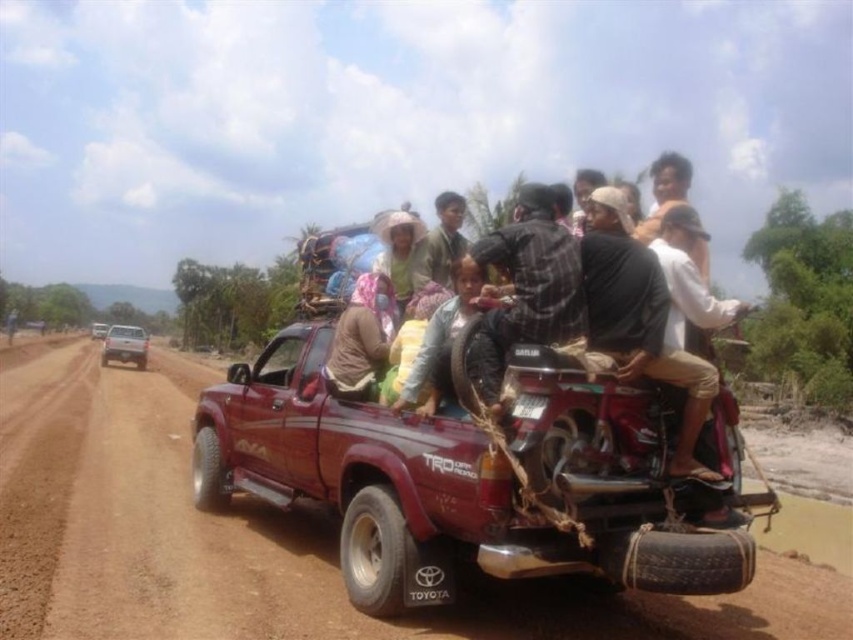
Question: Is light blue fabric at center smaller than metallic silver pickup truck at center-left?

Choices:
 (A) no
 (B) yes

Answer: (B)

Question: Which point is farther from the camera taking this photo?

Choices:
 (A) (334, 352)
 (B) (93, 326)
 (C) (426, 266)
 (D) (35, 426)

Answer: (B)

Question: Is metallic silver pickup truck at center wider than metallic silver pickup truck at center-left?

Choices:
 (A) no
 (B) yes

Answer: (B)

Question: Which point is farther to the camera?

Choices:
 (A) light blue fabric at center
 (B) metallic silver pickup truck at center
 (C) metallic silver pickup truck at center-left
 (D) brown dirt track at center

Answer: (C)

Question: Among these points, which one is nearest to the camera?

Choices:
 (A) (450, 250)
 (B) (351, 326)
 (C) (96, 330)
 (D) (106, 340)

Answer: (B)

Question: Does brown fabric bag at center lie in front of metallic silver pickup truck at center-left?

Choices:
 (A) no
 (B) yes

Answer: (B)